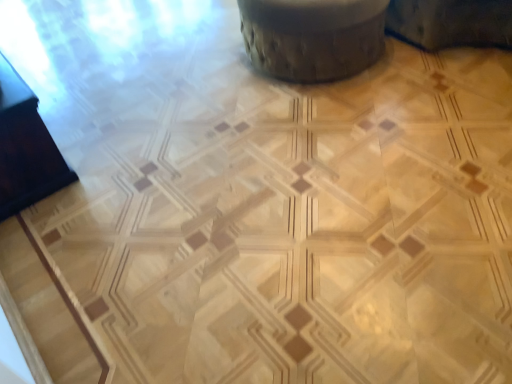
Question: Is black glossy drawer at left in front of wooden textured swivel chair at upper center?

Choices:
 (A) yes
 (B) no

Answer: (A)

Question: Considering the relative sizes of black glossy drawer at left and wooden textured swivel chair at upper center in the image provided, is black glossy drawer at left smaller than wooden textured swivel chair at upper center?

Choices:
 (A) yes
 (B) no

Answer: (A)

Question: Is black glossy drawer at left looking in the opposite direction of wooden textured swivel chair at upper center?

Choices:
 (A) no
 (B) yes

Answer: (A)

Question: Can you confirm if black glossy drawer at left is thinner than wooden textured swivel chair at upper center?

Choices:
 (A) yes
 (B) no

Answer: (A)

Question: Is black glossy drawer at left bigger than wooden textured swivel chair at upper center?

Choices:
 (A) no
 (B) yes

Answer: (A)

Question: From a real-world perspective, is black glossy drawer at left located beneath wooden textured swivel chair at upper center?

Choices:
 (A) no
 (B) yes

Answer: (B)

Question: Are wooden textured swivel chair at upper center and black glossy drawer at left located far from each other?

Choices:
 (A) yes
 (B) no

Answer: (A)

Question: Is the position of wooden textured swivel chair at upper center more distant than that of black glossy drawer at left?

Choices:
 (A) no
 (B) yes

Answer: (B)

Question: Considering the relative sizes of wooden textured swivel chair at upper center and black glossy drawer at left in the image provided, is wooden textured swivel chair at upper center smaller than black glossy drawer at left?

Choices:
 (A) no
 (B) yes

Answer: (A)

Question: Is wooden textured swivel chair at upper center shorter than black glossy drawer at left?

Choices:
 (A) yes
 (B) no

Answer: (B)

Question: Is wooden textured swivel chair at upper center positioned before black glossy drawer at left?

Choices:
 (A) no
 (B) yes

Answer: (A)

Question: Could you tell me if wooden textured swivel chair at upper center is facing black glossy drawer at left?

Choices:
 (A) yes
 (B) no

Answer: (B)

Question: In the image, is black glossy drawer at left on the left side or the right side of wooden textured swivel chair at upper center?

Choices:
 (A) right
 (B) left

Answer: (B)